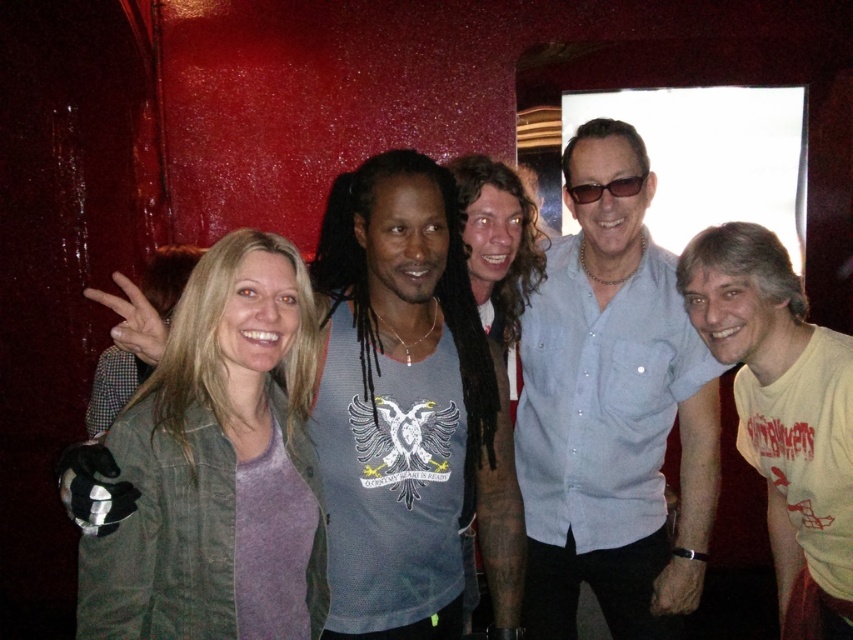
Question: Which point is closer to the camera?

Choices:
 (A) (505, 300)
 (B) (798, 477)
 (C) (579, 196)

Answer: (B)

Question: Among these points, which one is farthest from the camera?

Choices:
 (A) (360, 348)
 (B) (132, 449)
 (C) (509, 196)

Answer: (C)

Question: Is gray tank top at center closer to camera compared to matte purple shirt at center?

Choices:
 (A) yes
 (B) no

Answer: (A)

Question: Which object appears farthest from the camera in this image?

Choices:
 (A) gray tank top at center
 (B) light blue button-up shirt at center
 (C) matte purple shirt at center
 (D) yellow t-shirt at right

Answer: (C)

Question: In this image, where is gray tank top at center located relative to black plastic sunglasses at center?

Choices:
 (A) below
 (B) above

Answer: (A)

Question: Considering the relative positions of light blue button-up shirt at center and green denim jacket at center in the image provided, where is light blue button-up shirt at center located with respect to green denim jacket at center?

Choices:
 (A) right
 (B) left

Answer: (A)